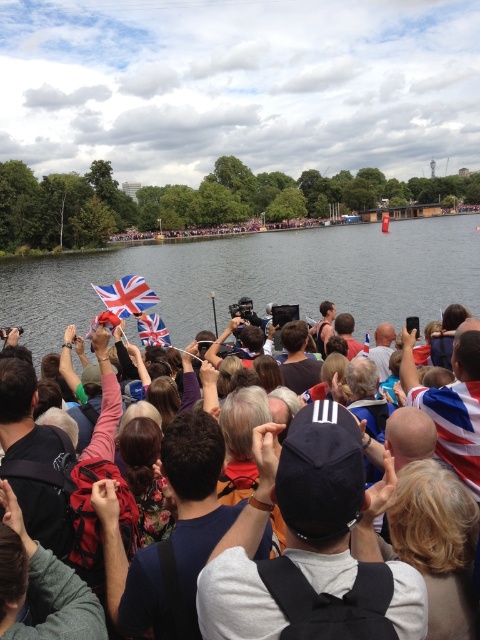
Question: Which object is positioned farthest from the striped fabric flag at center?

Choices:
 (A) union jack fabric flag at upper left
 (B) british flag fabric at center
 (C) union jack fabric flag at center

Answer: (C)

Question: Does british flag fabric at center have a lesser width compared to striped fabric flag at center?

Choices:
 (A) yes
 (B) no

Answer: (B)

Question: Can you confirm if striped fabric flag at center is smaller than union jack fabric flag at upper left?

Choices:
 (A) yes
 (B) no

Answer: (B)

Question: Is clear water at center smaller than striped fabric flag at center?

Choices:
 (A) yes
 (B) no

Answer: (B)

Question: Among these points, which one is farthest from the camera?

Choices:
 (A) (108, 305)
 (B) (215, 616)
 (C) (216, 273)

Answer: (C)

Question: Which point is closer to the camera?

Choices:
 (A) (144, 280)
 (B) (475, 394)

Answer: (B)